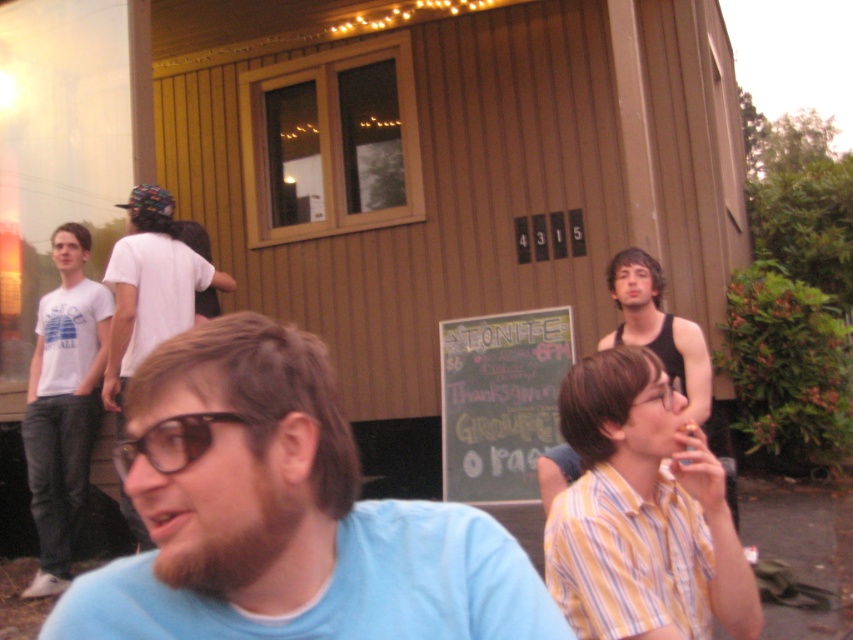
Between blue t-shirt at center and white matte t-shirt at left, which one appears on the right side from the viewer's perspective?

blue t-shirt at center

Does blue t-shirt at center appear on the left side of white matte t-shirt at left?

No, blue t-shirt at center is not to the left of white matte t-shirt at left.

This screenshot has width=853, height=640. What are the coordinates of `blue t-shirt at center` in the screenshot? It's located at (285, 515).

I want to click on blue t-shirt at center, so click(285, 515).

Measure the distance between point (314,492) and camera.

Point (314,492) and camera are 36.36 inches apart from each other.

Which is more to the right, blue t-shirt at center or striped cotton shirt at center?

From the viewer's perspective, striped cotton shirt at center appears more on the right side.

Where is `blue t-shirt at center`? blue t-shirt at center is located at coordinates (285, 515).

Does blue t-shirt at center appear over yellow striped shirt at lower right?

Correct, blue t-shirt at center is located above yellow striped shirt at lower right.

Locate an element on the screen. The height and width of the screenshot is (640, 853). blue t-shirt at center is located at coordinates (285, 515).

What are the coordinates of `blue t-shirt at center` in the screenshot? It's located at (285, 515).